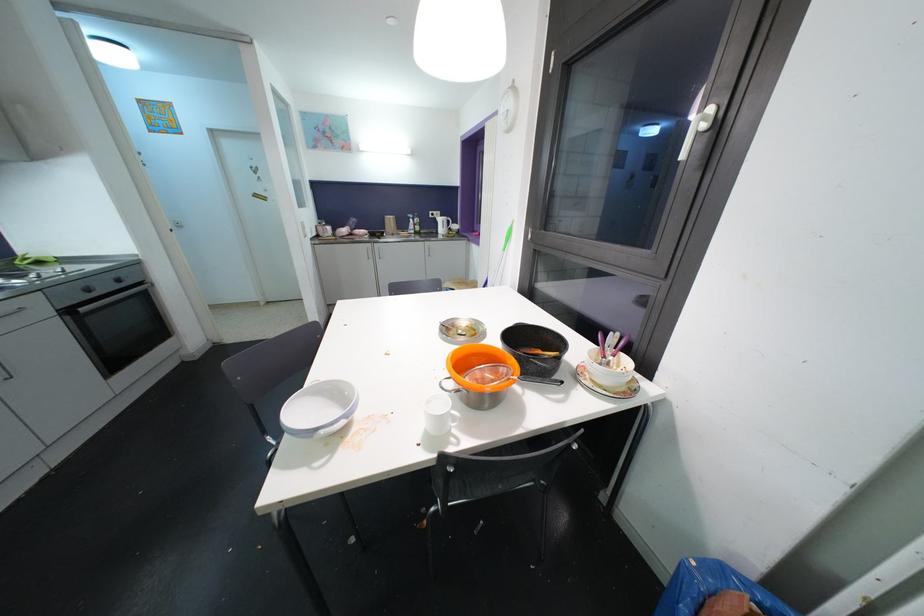
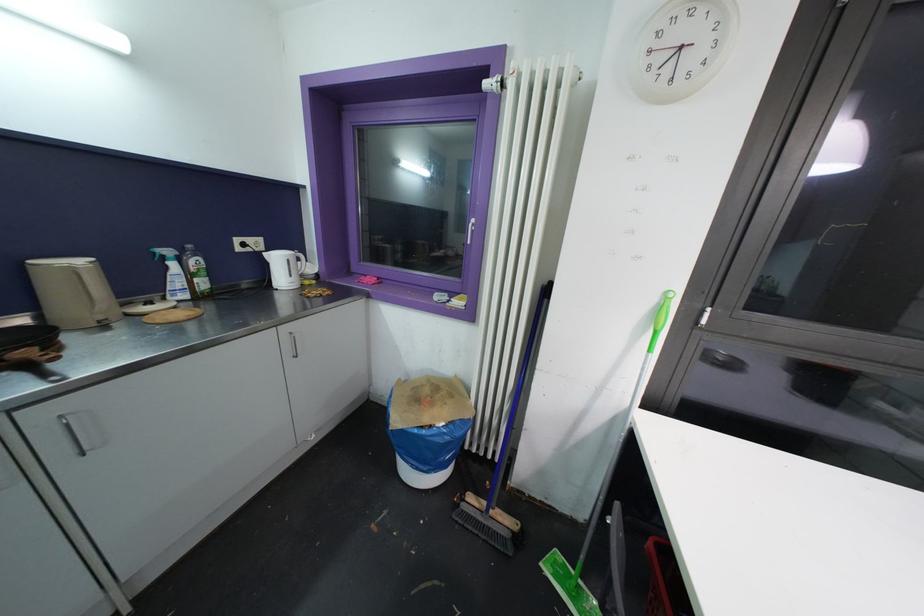
In the second image, find the point that corresponds to point 414,219 in the first image.

(171, 254)